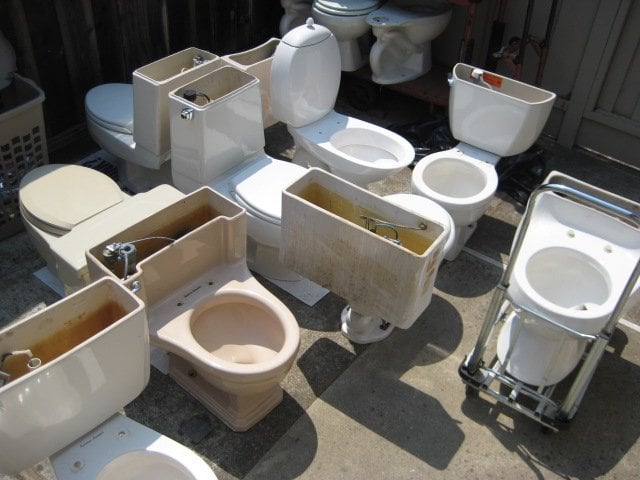
Identify the location of waste basket. Image resolution: width=640 pixels, height=480 pixels. (22, 124).